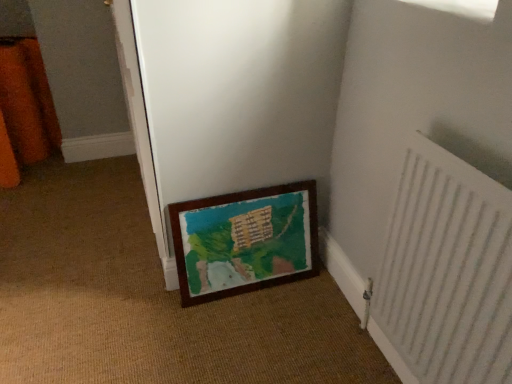
The width and height of the screenshot is (512, 384). Identify the location of free spot in front of wooden frame at lower center. (164, 313).